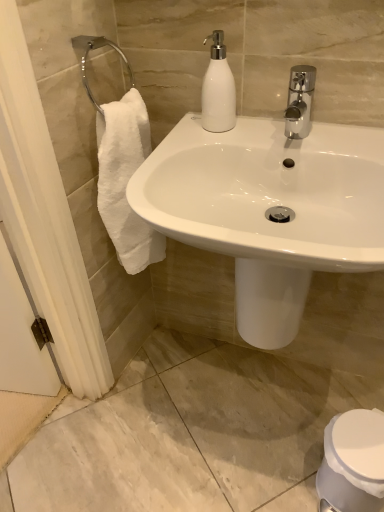
Question: Does white glossy soap dispenser at upper center have a smaller size compared to white glossy toilet at lower right?

Choices:
 (A) no
 (B) yes

Answer: (B)

Question: Is white glossy soap dispenser at upper center turned away from white glossy toilet at lower right?

Choices:
 (A) yes
 (B) no

Answer: (B)

Question: Is white glossy soap dispenser at upper center at the right side of white glossy toilet at lower right?

Choices:
 (A) yes
 (B) no

Answer: (B)

Question: Is white glossy soap dispenser at upper center outside white glossy toilet at lower right?

Choices:
 (A) yes
 (B) no

Answer: (A)

Question: Considering the relative sizes of white glossy soap dispenser at upper center and white glossy toilet at lower right in the image provided, is white glossy soap dispenser at upper center shorter than white glossy toilet at lower right?

Choices:
 (A) no
 (B) yes

Answer: (B)

Question: Considering the relative sizes of white glossy soap dispenser at upper center and white glossy toilet at lower right in the image provided, is white glossy soap dispenser at upper center taller than white glossy toilet at lower right?

Choices:
 (A) no
 (B) yes

Answer: (A)

Question: Is white glossy toilet at lower right oriented towards white glossy soap dispenser at upper center?

Choices:
 (A) no
 (B) yes

Answer: (A)

Question: Is white glossy toilet at lower right to the right of white glossy soap dispenser at upper center from the viewer's perspective?

Choices:
 (A) no
 (B) yes

Answer: (B)

Question: Is white glossy toilet at lower right to the left of white glossy soap dispenser at upper center from the viewer's perspective?

Choices:
 (A) no
 (B) yes

Answer: (A)

Question: Would you say white glossy toilet at lower right contains white glossy soap dispenser at upper center?

Choices:
 (A) yes
 (B) no

Answer: (B)

Question: From the image's perspective, is white glossy toilet at lower right below white glossy soap dispenser at upper center?

Choices:
 (A) yes
 (B) no

Answer: (A)

Question: Is white glossy toilet at lower right thinner than white glossy soap dispenser at upper center?

Choices:
 (A) yes
 (B) no

Answer: (B)

Question: Does point (206, 113) appear closer or farther from the camera than point (354, 436)?

Choices:
 (A) closer
 (B) farther

Answer: (A)